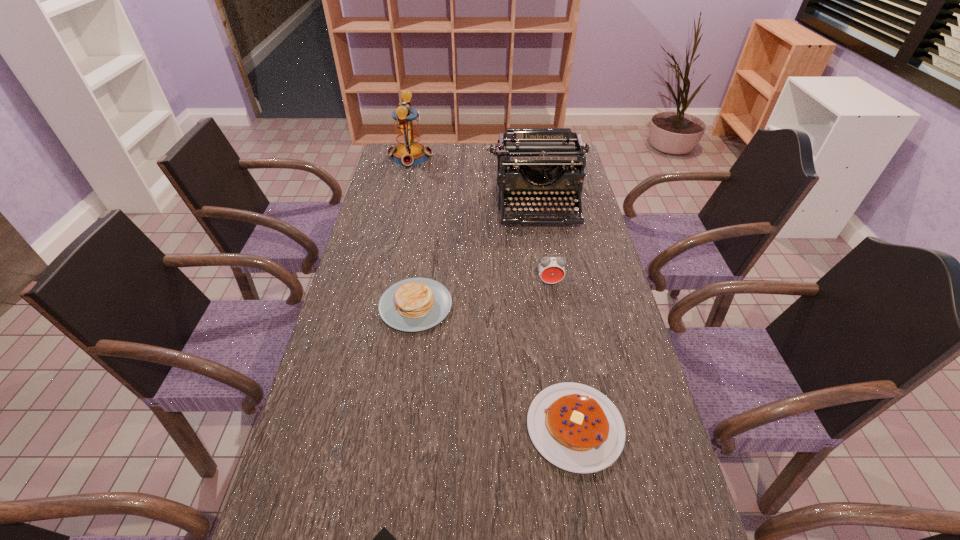
Locate an element on the screen. The height and width of the screenshot is (540, 960). the farthest object is located at coordinates pyautogui.click(x=409, y=151).

Find the location of a particular element. the fifth nearest object is located at coordinates (529, 151).

The image size is (960, 540). I want to click on alarm clock, so click(x=551, y=269).

You are a GUI agent. You are given a task and a screenshot of the screen. Output one action in this format:
    pyautogui.click(x=<x>, y=<y>)
    Task: Click on the left pancake
    The image size is (960, 540).
    Given the screenshot: What is the action you would take?
    pyautogui.click(x=415, y=304)

Where is `the right pancake`? This screenshot has width=960, height=540. the right pancake is located at coordinates (577, 428).

Locate an element on the screen. the second nearest object is located at coordinates pos(577,428).

You are a GUI agent. You are given a task and a screenshot of the screen. Output one action in this format:
    pyautogui.click(x=<x>, y=<y>)
    Task: Click on the free space located 0.260m on the front-facing side of the lantern
    Image resolution: width=960 pixels, height=540 pixels.
    Given the screenshot: What is the action you would take?
    pyautogui.click(x=495, y=157)

Where is `vacant point located 0.090m on the typing side of the second farthest object`? The image size is (960, 540). vacant point located 0.090m on the typing side of the second farthest object is located at coordinates (544, 247).

This screenshot has height=540, width=960. What are the coordinates of `free space located 0.100m on the face of the fourth shortest object` in the screenshot? It's located at (555, 314).

Where is `free space located 0.250m on the back of the farther pancake`? The width and height of the screenshot is (960, 540). free space located 0.250m on the back of the farther pancake is located at coordinates (426, 228).